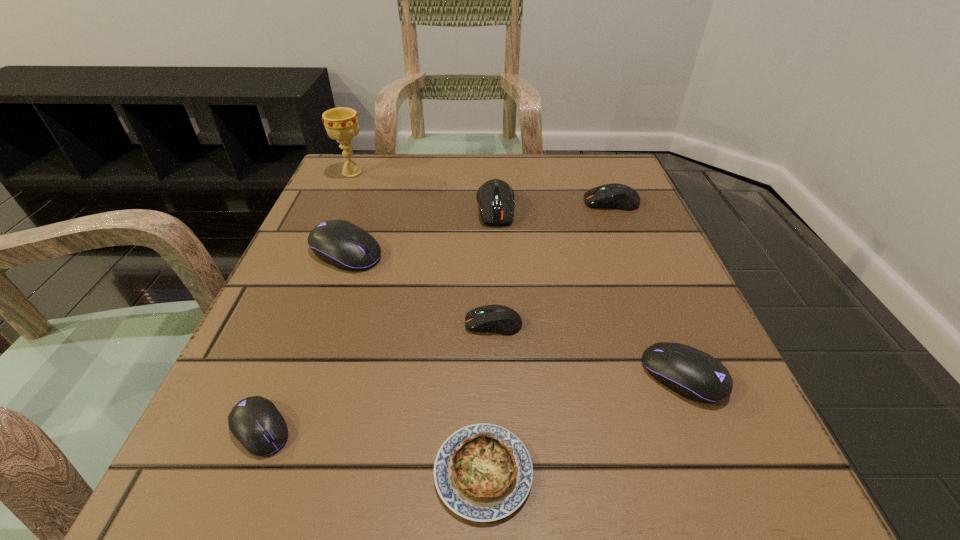
I want to click on free point located on the button of the smallest dark computer equipment, so click(x=389, y=323).

Where is `vacant space situated on the right of the smallest black computer mouse`? vacant space situated on the right of the smallest black computer mouse is located at coordinates (590, 429).

This screenshot has width=960, height=540. What are the coordinates of `free space located on the back of the shortest object` in the screenshot? It's located at (482, 248).

This screenshot has height=540, width=960. What are the coordinates of `chalice that is positioned at the far edge` in the screenshot? It's located at (341, 124).

Find the location of `computer mouse present at the near edge`. computer mouse present at the near edge is located at coordinates (255, 422).

Where is `quiche located in the near edge section of the desktop`? The image size is (960, 540). quiche located in the near edge section of the desktop is located at coordinates (483, 472).

The width and height of the screenshot is (960, 540). Find the location of `chalice at the left edge`. chalice at the left edge is located at coordinates (341, 124).

At what (x,y) coordinates should I click in order to perform the action: click on object at the far left corner. Please return your answer as a coordinate pair (x, y). The width and height of the screenshot is (960, 540). Looking at the image, I should click on (341, 124).

This screenshot has height=540, width=960. I want to click on object positioned at the near left corner, so click(x=255, y=422).

Locate an element on the screen. The width and height of the screenshot is (960, 540). object at the far right corner is located at coordinates (611, 196).